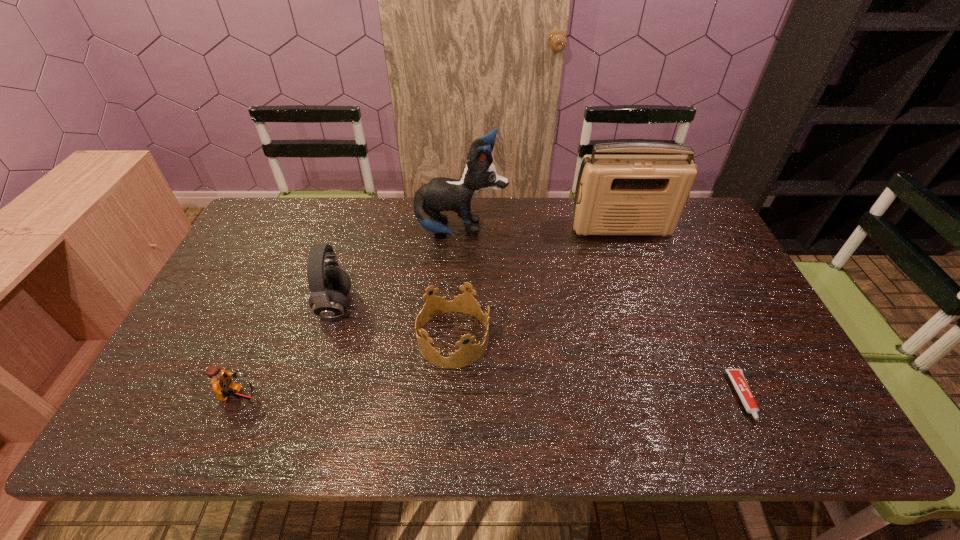
This screenshot has height=540, width=960. What are the coordinates of `vacant area situated on the front-facing side of the tiara` in the screenshot? It's located at (516, 339).

The image size is (960, 540). In order to click on vacant area situated 0.400m holding a crossbow in the hands of the Lego in this screenshot , I will do `click(432, 399)`.

Locate an element on the screen. puppy present at the far edge is located at coordinates (440, 194).

You are a GUI agent. You are given a task and a screenshot of the screen. Output one action in this format:
    pyautogui.click(x=<x>, y=<y>)
    Task: Click on the radio receiver present at the far edge
    This screenshot has width=960, height=540.
    Given the screenshot: What is the action you would take?
    pyautogui.click(x=615, y=194)

I want to click on Lego that is at the near edge, so click(221, 382).

Find the location of a particular element. Image resolution: width=960 pixels, height=540 pixels. toothpaste present at the near edge is located at coordinates click(x=737, y=377).

Find the location of `object that is positioned at the left edge`. object that is positioned at the left edge is located at coordinates (221, 382).

This screenshot has height=540, width=960. I want to click on radio receiver that is at the right edge, so click(615, 194).

Find the location of `toothpaste situated at the right edge`. toothpaste situated at the right edge is located at coordinates (737, 377).

Image resolution: width=960 pixels, height=540 pixels. In order to click on object that is at the near left corner in this screenshot , I will do pyautogui.click(x=221, y=382).